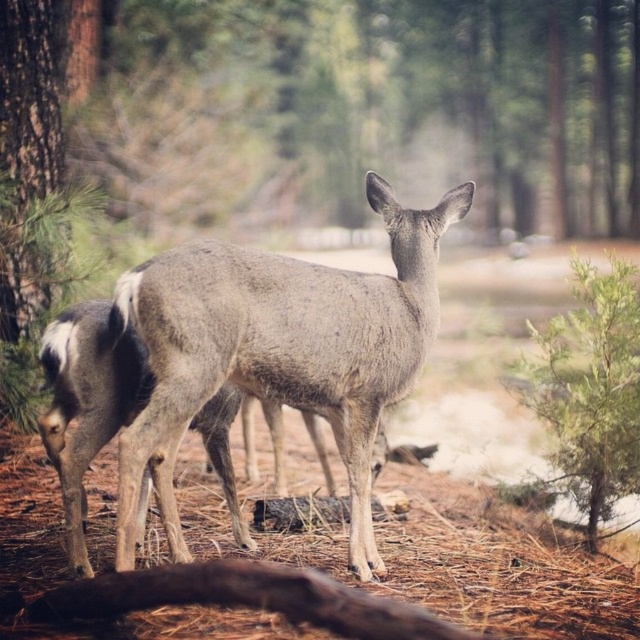
Who is positioned more to the right, fur-covered deer at center or brown rough log at lower center?

Positioned to the right is brown rough log at lower center.

Between point (141, 381) and point (224, 596), which one is positioned behind?

The point (141, 381) is behind.

Locate an element on the screen. fur-covered deer at center is located at coordinates (86, 403).

Does fur-like gray deer at center appear on the right side of brown rough log at lower center?

Yes, fur-like gray deer at center is to the right of brown rough log at lower center.

Between fur-like gray deer at center and brown rough log at lower center, which one has less height?

Standing shorter between the two is brown rough log at lower center.

Image resolution: width=640 pixels, height=640 pixels. I want to click on fur-like gray deer at center, so pyautogui.click(x=280, y=349).

Is fur-like gray deer at center closer to the viewer compared to fur-covered deer at center?

Yes.

Is fur-like gray deer at center shorter than fur-covered deer at center?

No, fur-like gray deer at center is not shorter than fur-covered deer at center.

Between point (372, 312) and point (68, 515), which one is positioned behind?

The point (372, 312) is behind.

At what (x,y) coordinates should I click in order to perform the action: click on fur-like gray deer at center. Please return your answer as a coordinate pair (x, y). This screenshot has height=640, width=640. Looking at the image, I should click on (280, 349).